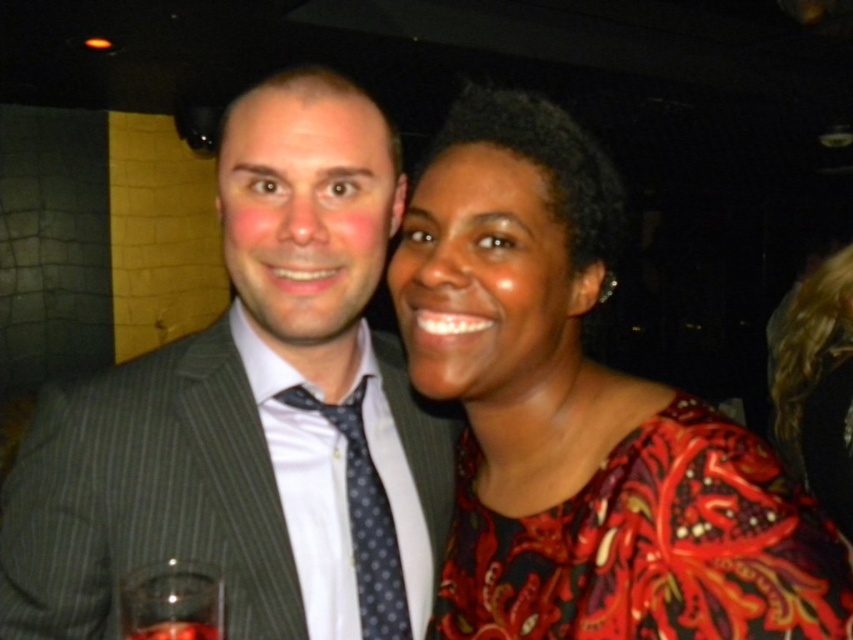
Question: Which point is closer to the camera?

Choices:
 (A) (810, 321)
 (B) (274, 397)
 (C) (281, 522)

Answer: (C)

Question: Can you confirm if floral-patterned fabric dress at center is thinner than floral-patterned blouse at right?

Choices:
 (A) no
 (B) yes

Answer: (B)

Question: Does gray pinstripe suit at center have a smaller size compared to floral-patterned blouse at center?

Choices:
 (A) no
 (B) yes

Answer: (A)

Question: Can you confirm if transparent glass at lower left is wider than translucent glass at lower left?

Choices:
 (A) no
 (B) yes

Answer: (B)

Question: Which point is farther to the camera?

Choices:
 (A) polka dot silk tie at center
 (B) floral-patterned fabric dress at center
 (C) floral-patterned blouse at center
 (D) gray pinstripe suit at center

Answer: (A)

Question: Estimate the real-world distances between objects in this image. Which object is farther from the floral-patterned blouse at center?

Choices:
 (A) polka dot silk tie at center
 (B) floral-patterned blouse at right

Answer: (B)